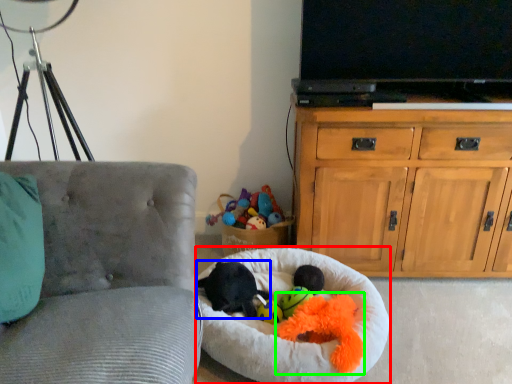
Question: Which object is the closest to the dog bed (highlighted by a red box)? Choose among these: animal (highlighted by a blue box) or toy (highlighted by a green box).

Choices:
 (A) animal
 (B) toy

Answer: (B)